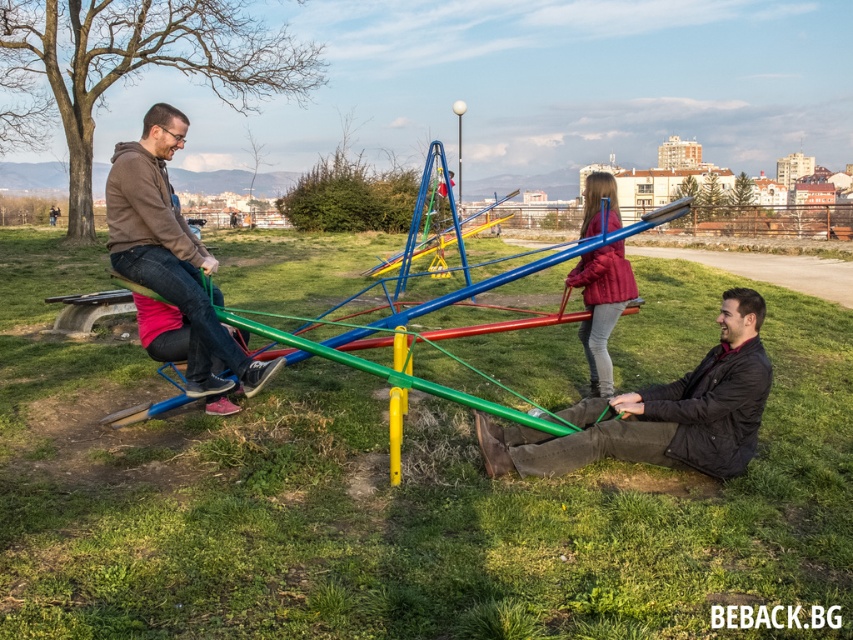
Question: Does green rubber band at center appear on the right side of black leather jacket at lower right?

Choices:
 (A) no
 (B) yes

Answer: (A)

Question: Is velvet red coat at center above metallic blue pole at center?

Choices:
 (A) no
 (B) yes

Answer: (A)

Question: Which of the following is the farthest from the observer?

Choices:
 (A) black leather jacket at lower right
 (B) metallic blue pole at center
 (C) green rubber band at center
 (D) velvet red coat at center

Answer: (B)

Question: Which point is farther to the camera?

Choices:
 (A) (160, 241)
 (B) (463, 106)

Answer: (B)

Question: Which of these objects is positioned closest to the matte brown jacket at left?

Choices:
 (A) green rubber band at center
 (B) black leather jacket at lower right

Answer: (B)

Question: From the image, what is the correct spatial relationship of velvet red coat at center in relation to metallic blue pole at center?

Choices:
 (A) below
 (B) above

Answer: (A)